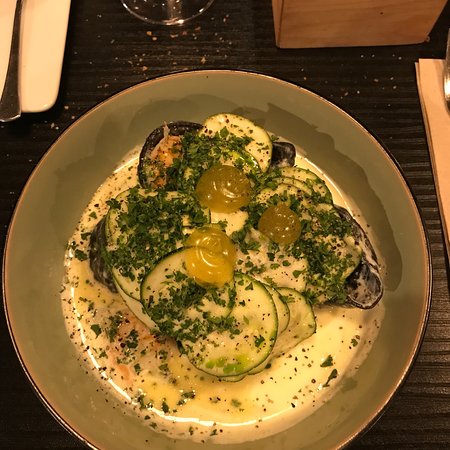
At what (x,y) coordinates should I click in order to perform the action: click on right edge of plate. Please return your answer as a coordinate pair (x, y). The width and height of the screenshot is (450, 450). Looking at the image, I should click on (429, 282).